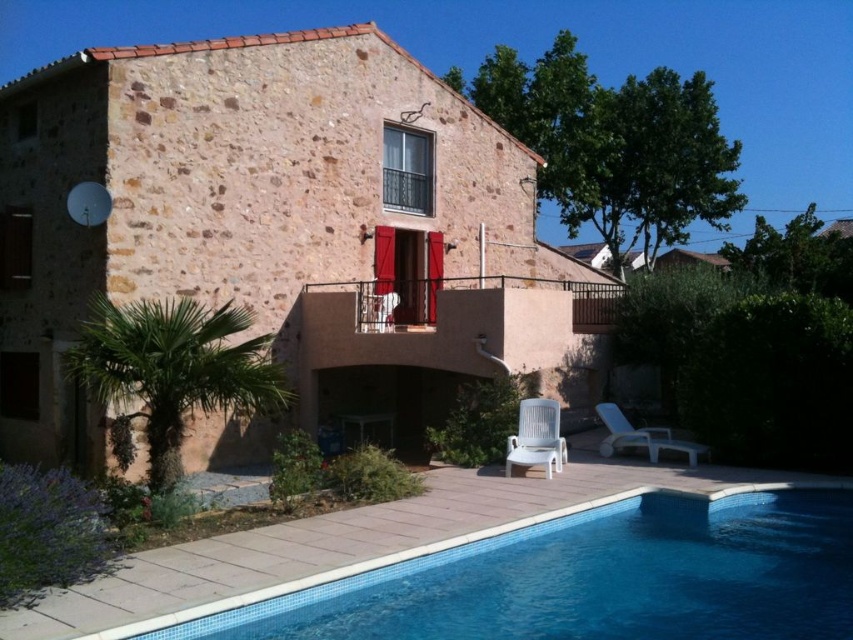
Between point (741, 515) and point (670, 435), which one is positioned behind?

Point (670, 435)

Can you confirm if blue tile swimming pool at lower center is positioned to the left of white plastic lounge chair at lower right?

Correct, you'll find blue tile swimming pool at lower center to the left of white plastic lounge chair at lower right.

Where is `blue tile swimming pool at lower center`? The height and width of the screenshot is (640, 853). blue tile swimming pool at lower center is located at coordinates (581, 579).

Is the position of blue tile swimming pool at lower center less distant than that of white plastic chair at lower right?

Yes, blue tile swimming pool at lower center is in front of white plastic chair at lower right.

Does blue tile swimming pool at lower center appear under white plastic chair at lower right?

Yes.

What do you see at coordinates (581, 579) in the screenshot?
I see `blue tile swimming pool at lower center` at bounding box center [581, 579].

Locate an element on the screen. blue tile swimming pool at lower center is located at coordinates [x=581, y=579].

Can you confirm if brown stone villa at center is bigger than white plastic lounge chair at lower right?

Yes.

Is brown stone villa at center positioned before white plastic lounge chair at lower right?

Yes, brown stone villa at center is closer to the viewer.

Who is more distant from viewer, (102, 161) or (688, 442)?

The point (688, 442) is behind.

Where is `brown stone villa at center`? This screenshot has height=640, width=853. brown stone villa at center is located at coordinates (241, 198).